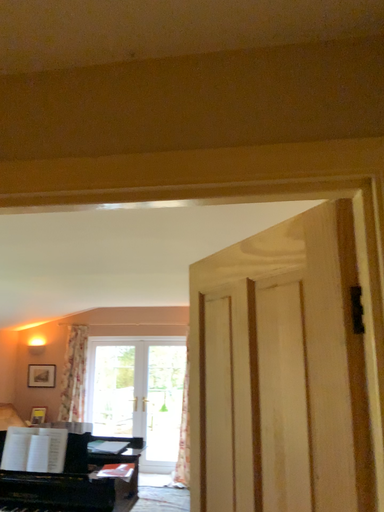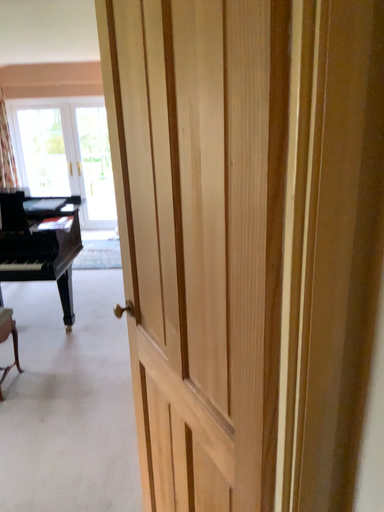
Question: Which way did the camera rotate in the video?

Choices:
 (A) rotated upward
 (B) rotated downward

Answer: (B)